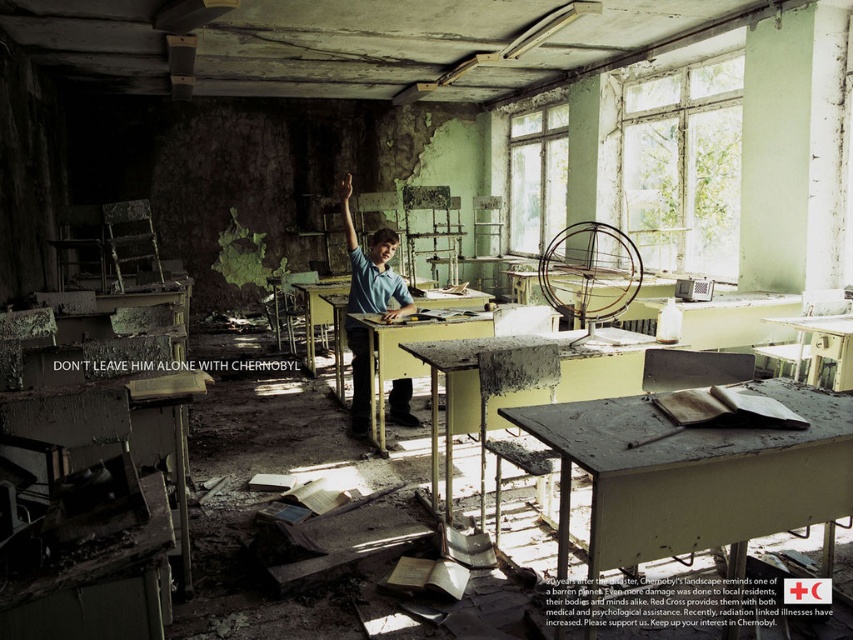
How distant is matte gray desk at center from yellow matte desk at center?

matte gray desk at center is 7.19 feet from yellow matte desk at center.

Can you confirm if matte gray desk at center is thinner than yellow matte desk at center?

In fact, matte gray desk at center might be wider than yellow matte desk at center.

At what (x,y) coordinates should I click in order to perform the action: click on matte gray desk at center. Please return your answer as a coordinate pair (x, y). Looking at the image, I should click on (520, 388).

Can you confirm if matte gray desk at center is positioned above blue shirt at center?

No, matte gray desk at center is not above blue shirt at center.

Where is `matte gray desk at center`? This screenshot has height=640, width=853. matte gray desk at center is located at coordinates (520, 388).

The image size is (853, 640). Identify the location of matte gray desk at center. (520, 388).

Is matte gray desk at center taller than matte yellow desk at center?

Yes.

Does matte gray desk at center have a larger size compared to matte yellow desk at center?

Correct, matte gray desk at center is larger in size than matte yellow desk at center.

Which is in front, point (431, 404) or point (834, 326)?

Point (431, 404) is more forward.

You are a GUI agent. You are given a task and a screenshot of the screen. Output one action in this format:
    pyautogui.click(x=<x>, y=<y>)
    Task: Click on the matte gray desk at center
    This screenshot has height=640, width=853.
    Given the screenshot: What is the action you would take?
    pyautogui.click(x=520, y=388)